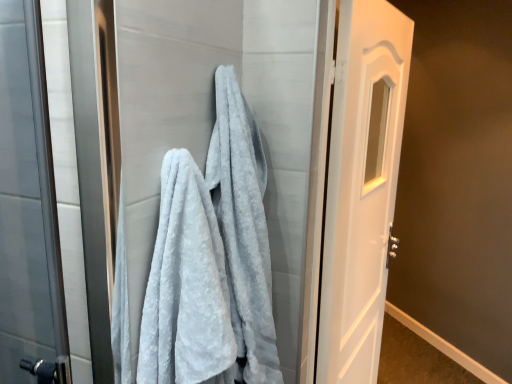
Describe the element at coordinates (361, 186) in the screenshot. I see `white glossy door at right` at that location.

I want to click on light gray fluffy towel at center, so tap(186, 286).

At what (x,y) coordinates should I click in order to perform the action: click on gray fluffy towel at center. Please return your answer as a coordinate pair (x, y). Looking at the image, I should click on (213, 123).

Is gray fluffy towel at center facing away from white glossy door at right?

No, gray fluffy towel at center's orientation is not away from white glossy door at right.

Which object is further away from the camera, gray fluffy towel at center or white glossy door at right?

white glossy door at right is further away from the camera.

The image size is (512, 384). Find the location of `door located underneath the gray fluffy towel at center (from a real-world perspective)`. door located underneath the gray fluffy towel at center (from a real-world perspective) is located at coordinates pos(361,186).

Would you say gray fluffy towel at center is to the left or to the right of white glossy door at right in the picture?

gray fluffy towel at center is to the left of white glossy door at right.

From the image's perspective, who appears lower, white glossy door at right or light gray fluffy towel at center?

white glossy door at right, from the image's perspective.

Which of these two, white glossy door at right or light gray fluffy towel at center, is bigger?

white glossy door at right.

Is white glossy door at right far away from light gray fluffy towel at center?

No, there isn't a large distance between white glossy door at right and light gray fluffy towel at center.

In terms of width, does white glossy door at right look wider or thinner when compared to light gray fluffy towel at center?

white glossy door at right is thinner than light gray fluffy towel at center.

Is gray fluffy towel at center far from light gray fluffy towel at center?

They are positioned close to each other.

Considering the relative sizes of gray fluffy towel at center and light gray fluffy towel at center in the image provided, is gray fluffy towel at center shorter than light gray fluffy towel at center?

No.

Locate an element on the screen. This screenshot has width=512, height=384. screen door behind the light gray fluffy towel at center is located at coordinates (213, 123).

Does gray fluffy towel at center contain light gray fluffy towel at center?

That's incorrect, light gray fluffy towel at center is not inside gray fluffy towel at center.

Is light gray fluffy towel at center facing towards gray fluffy towel at center?

No, light gray fluffy towel at center is not oriented towards gray fluffy towel at center.

Which object is further away from the camera, light gray fluffy towel at center or gray fluffy towel at center?

gray fluffy towel at center is more distant.

From a real-world perspective, between light gray fluffy towel at center and gray fluffy towel at center, who is vertically lower?

From a 3D spatial view, gray fluffy towel at center is below.

Identify the location of towel located in front of the gray fluffy towel at center. This screenshot has width=512, height=384. (186, 286).

Measure the distance between light gray fluffy towel at center and white glossy door at right.

light gray fluffy towel at center and white glossy door at right are 31.19 inches apart from each other.

Identify the location of towel in front of the white glossy door at right. (186, 286).

Which object is further away from the camera, light gray fluffy towel at center or white glossy door at right?

white glossy door at right.

From the image's perspective, is light gray fluffy towel at center under white glossy door at right?

Actually, light gray fluffy towel at center appears above white glossy door at right in the image.

Who is taller, white glossy door at right or gray fluffy towel at center?

white glossy door at right.

Can you tell me how much white glossy door at right and gray fluffy towel at center differ in facing direction?

The angle between the facing direction of white glossy door at right and the facing direction of gray fluffy towel at center is 7.32 degrees.

From the picture: Is white glossy door at right inside or outside of gray fluffy towel at center?

white glossy door at right is not inside gray fluffy towel at center, it's outside.

Find the location of a particular element. The width and height of the screenshot is (512, 384). screen door above the white glossy door at right (from a real-world perspective) is located at coordinates (213, 123).

In the image, there is a white glossy door at right. Where is `towel above it (from the image's perspective)`? The height and width of the screenshot is (384, 512). towel above it (from the image's perspective) is located at coordinates (x=186, y=286).

Estimate the real-world distances between objects in this image. Which object is closer to gray fluffy towel at center, white glossy door at right or light gray fluffy towel at center?

light gray fluffy towel at center.

Which object lies further to the anchor point white glossy door at right, light gray fluffy towel at center or gray fluffy towel at center?

The object further to white glossy door at right is light gray fluffy towel at center.

Estimate the real-world distances between objects in this image. Which object is further from white glossy door at right, gray fluffy towel at center or light gray fluffy towel at center?

The object further to white glossy door at right is light gray fluffy towel at center.

Consider the image. Considering their positions, is light gray fluffy towel at center positioned closer to gray fluffy towel at center than white glossy door at right?

light gray fluffy towel at center is closer to gray fluffy towel at center.

Based on their spatial positions, is gray fluffy towel at center or white glossy door at right closer to light gray fluffy towel at center?

gray fluffy towel at center is closer to light gray fluffy towel at center.

Based on their spatial positions, is white glossy door at right or gray fluffy towel at center closer to light gray fluffy towel at center?

gray fluffy towel at center is positioned closer to the anchor light gray fluffy towel at center.

You are a GUI agent. You are given a task and a screenshot of the screen. Output one action in this format:
    pyautogui.click(x=<x>, y=<y>)
    Task: Click on the screen door between light gray fluffy towel at center and white glossy door at right in the front-back direction
    The height and width of the screenshot is (384, 512).
    Given the screenshot: What is the action you would take?
    pyautogui.click(x=213, y=123)